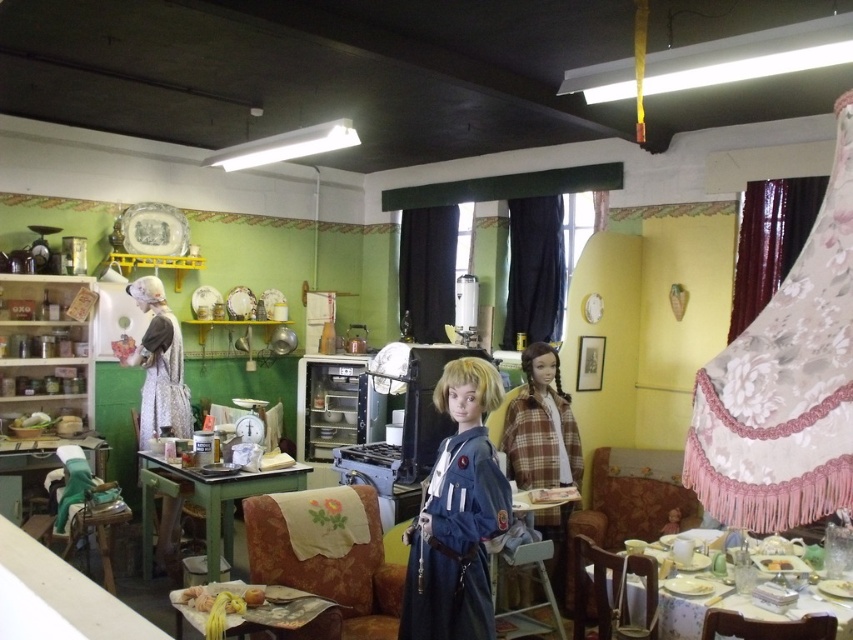
You are a visitor in the museum and want to take a photo of the plaid fabric doll at center and the wooden table with cloth at lower left. Which object is taller?

The plaid fabric doll at center is taller than the wooden table with cloth at lower left.

From the picture: You are a visitor in this historical kitchen exhibit and want to place a small decorative item on the green painted wood table at lower left and the smooth yellow cake at lower right. Which surface can accommodate a larger item?

The green painted wood table at lower left can accommodate a larger item since it is bigger than the smooth yellow cake at lower right.

You are a visitor in the vintage kitchen exhibit and want to take a photo of both the smooth yellow cake at lower right and the yellow matte apple at lower center. Which object should you focus on first to ensure both are in the frame?

You should focus on the smooth yellow cake at lower right first because it is closer to you than the yellow matte apple at lower center, ensuring both are in the frame.